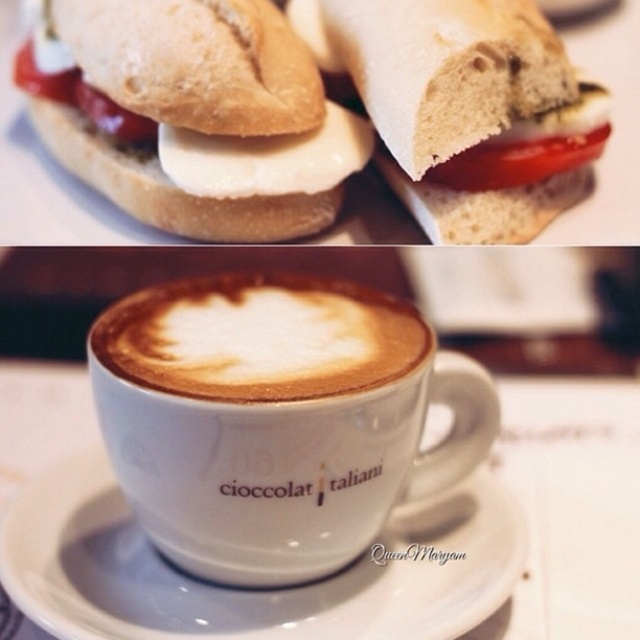
Question: Is white matte cup at center bigger than red glossy tomato at center?

Choices:
 (A) no
 (B) yes

Answer: (B)

Question: Which point is closer to the camera taking this photo?

Choices:
 (A) (522, 106)
 (B) (189, 426)

Answer: (B)

Question: Among these objects, which one is farthest from the camera?

Choices:
 (A) white soft bread at upper left
 (B) red glossy tomato at center
 (C) white soft bread at upper center
 (D) white frothy coffee at center

Answer: (B)

Question: Estimate the real-world distances between objects in this image. Which object is closer to the white soft bread at upper left?

Choices:
 (A) white soft bread at upper center
 (B) white frothy coffee at center
 (C) red glossy tomato at center
 (D) white ceramic saucer at center

Answer: (A)

Question: Is white soft bread at upper center closer to camera compared to red glossy tomato at center?

Choices:
 (A) yes
 (B) no

Answer: (A)

Question: Does white ceramic saucer at center have a lesser width compared to white soft bread at upper center?

Choices:
 (A) no
 (B) yes

Answer: (A)